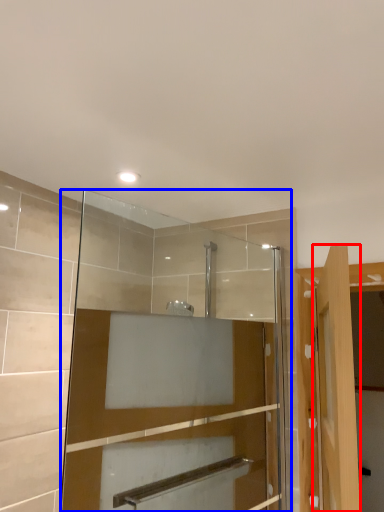
Question: Which object is closer to the camera taking this photo, door (highlighted by a red box) or mirror (highlighted by a blue box)?

Choices:
 (A) door
 (B) mirror

Answer: (A)